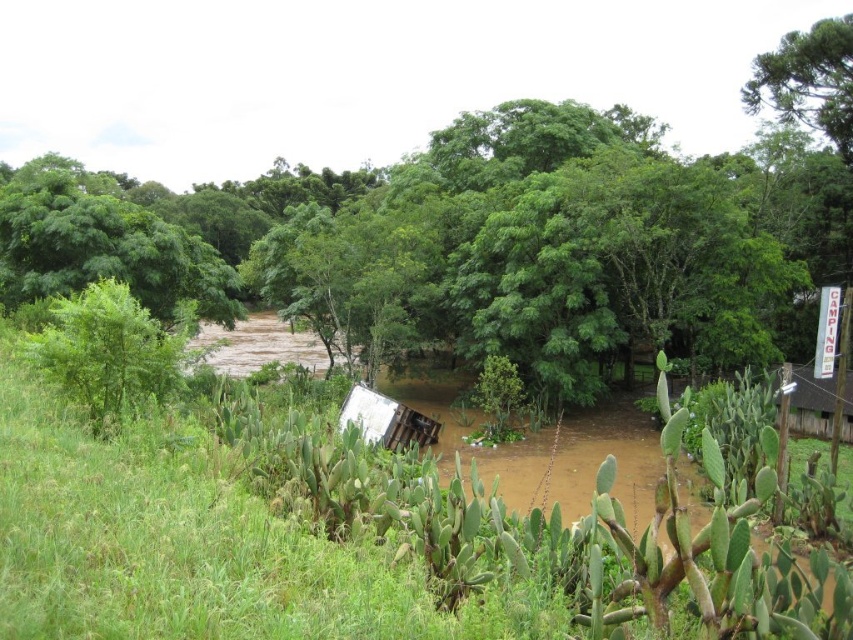
You are standing in the flooded area and want to reach the green leafy tree at left. Given your current position, in which direction should you move to get closer to the tree?

You should move to the left to get closer to the green leafy tree at left since it is located at point [107,353].

You are standing at point (107, 353) in the flooded area. What object is located exactly at your current position?

The green leafy tree at left is located exactly at point (107, 353).